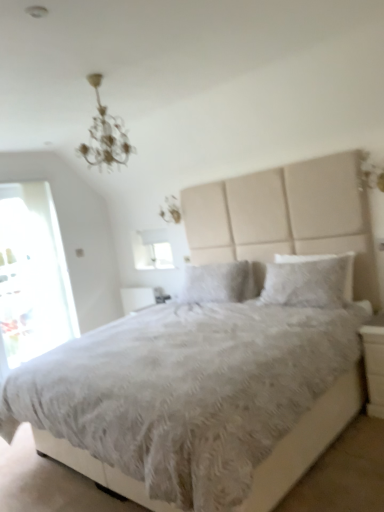
Question: Considering the relative positions of white fluffy pillow at center, which is counted as the second pillow, starting from the left, and white fluffy bed at center in the image provided, is white fluffy pillow at center, which is counted as the second pillow, starting from the left, to the left of white fluffy bed at center from the viewer's perspective?

Choices:
 (A) yes
 (B) no

Answer: (B)

Question: Does white fluffy pillow at center, which is counted as the second pillow, starting from the left, lie behind white fluffy bed at center?

Choices:
 (A) no
 (B) yes

Answer: (B)

Question: Does white fluffy pillow at center, which ranks as the 1th pillow in front-to-back order, have a greater width compared to white fluffy bed at center?

Choices:
 (A) no
 (B) yes

Answer: (A)

Question: Is white fluffy pillow at center, which is counted as the second pillow, starting from the left, not near white fluffy bed at center?

Choices:
 (A) no
 (B) yes

Answer: (B)

Question: Considering the relative sizes of white fluffy pillow at center, which is counted as the second pillow, starting from the left, and white fluffy bed at center in the image provided, is white fluffy pillow at center, which is counted as the second pillow, starting from the left, smaller than white fluffy bed at center?

Choices:
 (A) yes
 (B) no

Answer: (A)

Question: Considering the positions of white matte window screen at upper center and white glossy nightstand at lower right in the image, is white matte window screen at upper center bigger or smaller than white glossy nightstand at lower right?

Choices:
 (A) small
 (B) big

Answer: (B)

Question: From their relative heights in the image, would you say white matte window screen at upper center is taller or shorter than white glossy nightstand at lower right?

Choices:
 (A) tall
 (B) short

Answer: (B)

Question: From a real-world perspective, relative to white glossy nightstand at lower right, is white matte window screen at upper center vertically above or below?

Choices:
 (A) below
 (B) above

Answer: (B)

Question: Is point (170, 259) positioned closer to the camera than point (382, 356)?

Choices:
 (A) farther
 (B) closer

Answer: (A)

Question: From a real-world perspective, is white glossy nightstand at lower right positioned above or below fluffy white pillow at center, acting as the second pillow starting from the front?

Choices:
 (A) above
 (B) below

Answer: (B)

Question: In the image, is white glossy nightstand at lower right positioned in front of or behind fluffy white pillow at center, the first pillow from the back?

Choices:
 (A) behind
 (B) front

Answer: (B)

Question: Is point (365, 359) positioned closer to the camera than point (193, 269)?

Choices:
 (A) farther
 (B) closer

Answer: (B)

Question: In terms of height, does white glossy nightstand at lower right look taller or shorter compared to fluffy white pillow at center, the first pillow from the back?

Choices:
 (A) short
 (B) tall

Answer: (B)

Question: Is white glossy nightstand at lower right spatially inside transparent glass door at left, or outside of it?

Choices:
 (A) inside
 (B) outside

Answer: (B)

Question: From their relative heights in the image, would you say white glossy nightstand at lower right is taller or shorter than transparent glass door at left?

Choices:
 (A) short
 (B) tall

Answer: (A)